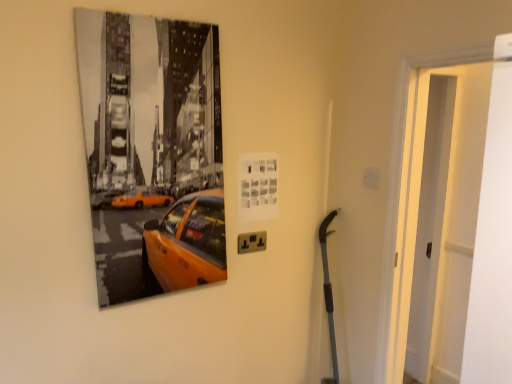
Question: Considering the relative sizes of white matte door at right and black plastic/socket at lower center in the image provided, is white matte door at right bigger than black plastic/socket at lower center?

Choices:
 (A) yes
 (B) no

Answer: (A)

Question: Can you confirm if white matte door at right is thinner than black plastic/socket at lower center?

Choices:
 (A) yes
 (B) no

Answer: (B)

Question: Is white matte door at right completely or partially outside of black plastic/socket at lower center?

Choices:
 (A) yes
 (B) no

Answer: (A)

Question: Is white matte door at right far from black plastic/socket at lower center?

Choices:
 (A) yes
 (B) no

Answer: (A)

Question: Is black plastic/socket at lower center completely or partially inside white matte door at right?

Choices:
 (A) yes
 (B) no

Answer: (B)

Question: Is black plastic/socket at lower center at the back of white matte door at right?

Choices:
 (A) yes
 (B) no

Answer: (B)

Question: From the image's perspective, is black plastic/socket at lower center above white matte door at right?

Choices:
 (A) no
 (B) yes

Answer: (A)

Question: From a real-world perspective, does black plastic/socket at lower center sit lower than white matte door at right?

Choices:
 (A) no
 (B) yes

Answer: (B)

Question: Does black plastic/socket at lower center appear on the left side of white matte door at right?

Choices:
 (A) no
 (B) yes

Answer: (B)

Question: Considering the relative sizes of black plastic/socket at lower center and white matte door at right in the image provided, is black plastic/socket at lower center smaller than white matte door at right?

Choices:
 (A) no
 (B) yes

Answer: (B)

Question: Is black plastic/socket at lower center not close to white matte door at right?

Choices:
 (A) no
 (B) yes

Answer: (B)

Question: Is white matte door at right a part of black plastic/socket at lower center?

Choices:
 (A) yes
 (B) no

Answer: (B)

Question: Is point (245, 233) closer or farther from the camera than point (489, 87)?

Choices:
 (A) farther
 (B) closer

Answer: (A)